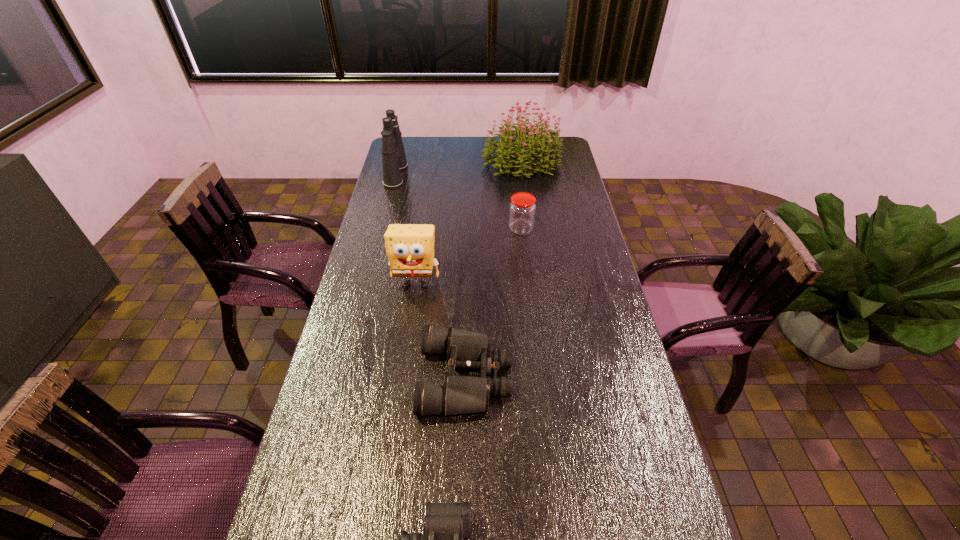
This screenshot has height=540, width=960. I want to click on free space that satisfies the following two spatial constraints: 1. on the front side of the third shortest object; 2. on the right side of the farthest binoculars, so click(382, 230).